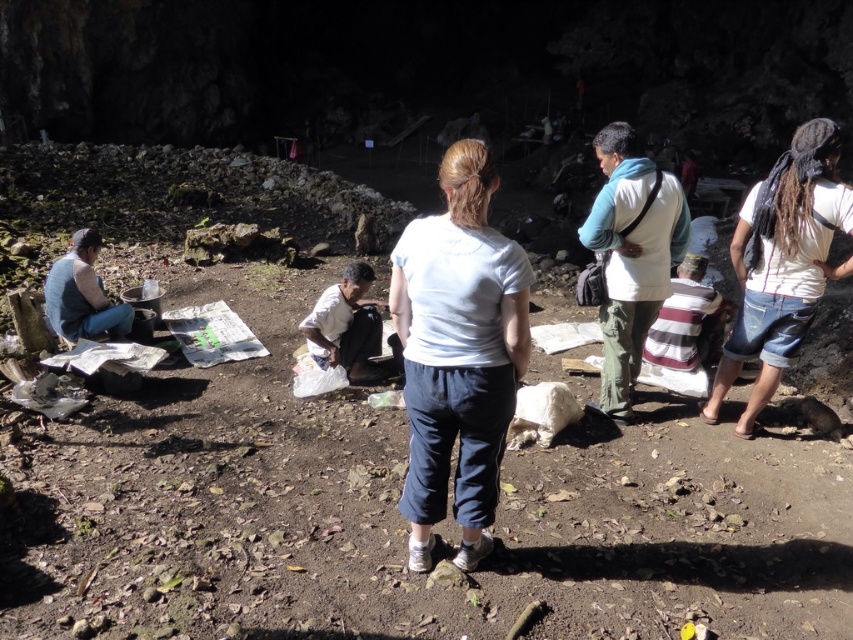
Question: Among these points, which one is nearest to the camera?

Choices:
 (A) (335, 342)
 (B) (415, 440)

Answer: (B)

Question: Which object is farther from the camera taking this photo?

Choices:
 (A) white cotton shirt at right
 (B) white fabric bag at center
 (C) white cotton shirt at center

Answer: (B)

Question: Which object is the closest to the white cotton shirt at right?

Choices:
 (A) white cotton shirt at center
 (B) white fabric bag at center

Answer: (A)

Question: Does white cotton shirt at center have a greater width compared to white fabric bag at center?

Choices:
 (A) no
 (B) yes

Answer: (B)

Question: Is white cotton shirt at center in front of white cotton shirt at right?

Choices:
 (A) no
 (B) yes

Answer: (B)

Question: Does white cotton shirt at right lie behind white fabric bag at center?

Choices:
 (A) no
 (B) yes

Answer: (A)